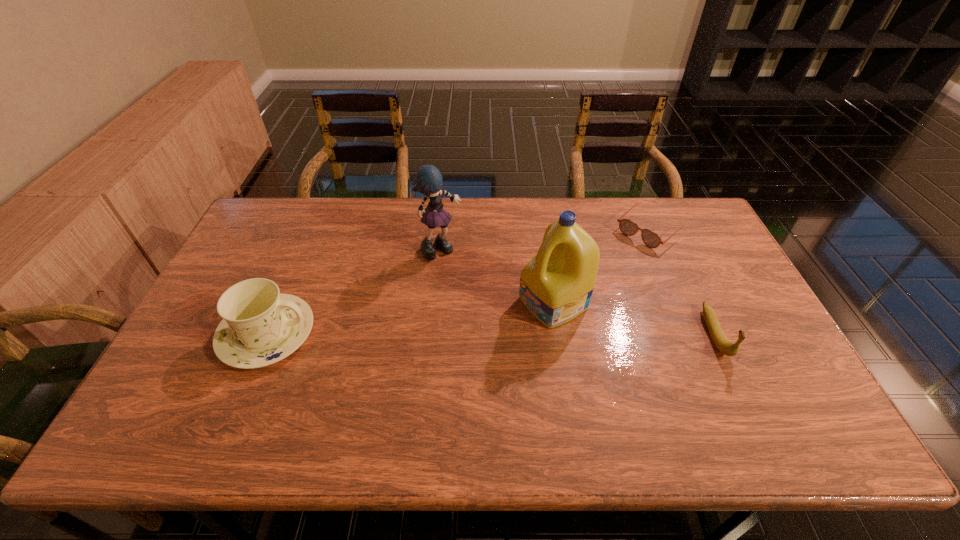
This screenshot has width=960, height=540. Find the location of `banana located in the right edge section of the desktop`. banana located in the right edge section of the desktop is located at coordinates [720, 340].

Where is `sunglasses at the right edge`? The width and height of the screenshot is (960, 540). sunglasses at the right edge is located at coordinates (651, 239).

Where is `object located at the near left corner`? object located at the near left corner is located at coordinates (261, 326).

Where is `object at the far right corner`? The height and width of the screenshot is (540, 960). object at the far right corner is located at coordinates click(x=651, y=239).

You are a GUI agent. You are given a task and a screenshot of the screen. Output one action in this format:
    pyautogui.click(x=<x>, y=<y>)
    Task: Click on the vacant space at the far edge of the desktop
    The width and height of the screenshot is (960, 540).
    Given the screenshot: What is the action you would take?
    pyautogui.click(x=608, y=219)

Where is `free space at the near edge of the desktop`? This screenshot has height=540, width=960. free space at the near edge of the desktop is located at coordinates (244, 376).

At what (x,y) coordinates should I click in order to perform the action: click on free space at the left edge of the desktop. Please return your answer as a coordinate pair (x, y). The width and height of the screenshot is (960, 540). Looking at the image, I should click on (207, 359).

You are a GUI agent. You are given a task and a screenshot of the screen. Output one action in this format:
    pyautogui.click(x=<x>, y=<y>)
    Task: Click on the free space at the right edge of the desktop
    
    Given the screenshot: What is the action you would take?
    pyautogui.click(x=716, y=271)

This screenshot has width=960, height=540. What are the coordinates of `blank area at the near left corner` in the screenshot? It's located at (156, 391).

Where is `free point between the shortest object and the second shortest object`? This screenshot has width=960, height=540. free point between the shortest object and the second shortest object is located at coordinates (683, 282).